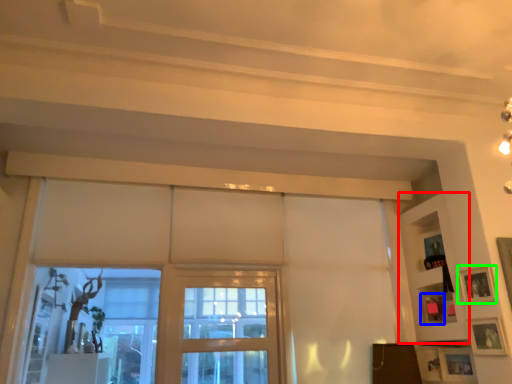
Question: Estimate the real-world distances between objects in this image. Which object is closer to shelf (highlighted by a red box), picture frame (highlighted by a blue box) or picture frame (highlighted by a green box)?

Choices:
 (A) picture frame
 (B) picture frame

Answer: (A)